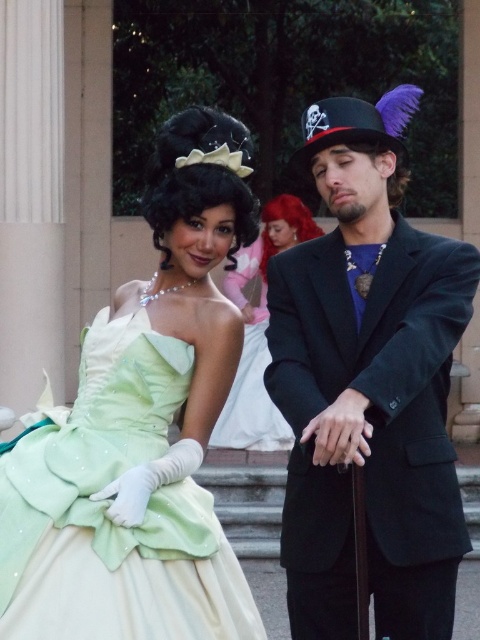
You are standing at the origin point in the image and want to move towards the point at position (156, 420). Is this point closer to you than the other point at (275, 429)?

Yes, the point at (156, 420) is closer to you than the point at (275, 429) because it is in front of it.

You are at a costume party and see two guests wearing green dresses. The first is wearing a lime satin dress at left, and the second is wearing a matte green dress at center. Which dress is positioned more to the left side of the image?

The lime satin dress at left is positioned more to the left side of the image than the matte green dress at center.